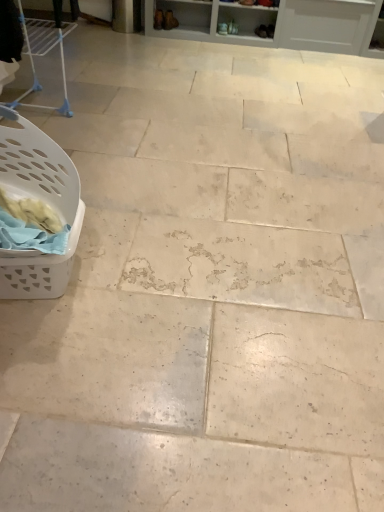
Question: Looking at the image, does matte brown boot at upper center, acting as the first footwear starting from the left, seem bigger or smaller compared to white plastic laundry basket at left?

Choices:
 (A) big
 (B) small

Answer: (B)

Question: Considering the relative positions of matte brown boot at upper center, the second footwear when ordered from right to left, and white plastic laundry basket at left in the image provided, is matte brown boot at upper center, the second footwear when ordered from right to left, to the left or to the right of white plastic laundry basket at left?

Choices:
 (A) right
 (B) left

Answer: (A)

Question: Considering the real-world distances, which object is closest to the matte brown shoe at upper center, which is the second footwear from left to right?

Choices:
 (A) matte brown boot at upper center, the second footwear when ordered from right to left
 (B) white plastic laundry basket at left

Answer: (A)

Question: Estimate the real-world distances between objects in this image. Which object is closer to the white plastic laundry basket at left?

Choices:
 (A) matte brown boot at upper center, the second footwear when ordered from right to left
 (B) matte brown shoe at upper center, the 1th footwear viewed from the right

Answer: (A)